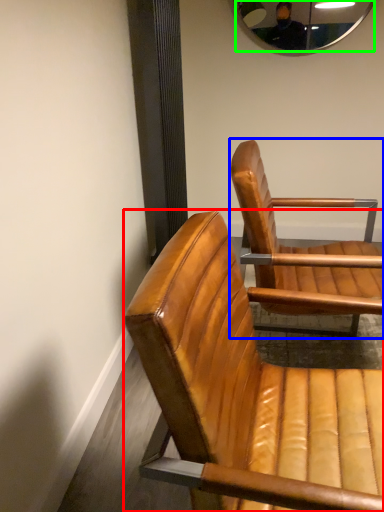
Question: Which object is positioned closest to chair (highlighted by a red box)? Select from chair (highlighted by a blue box) and mirror (highlighted by a green box).

Choices:
 (A) chair
 (B) mirror

Answer: (A)